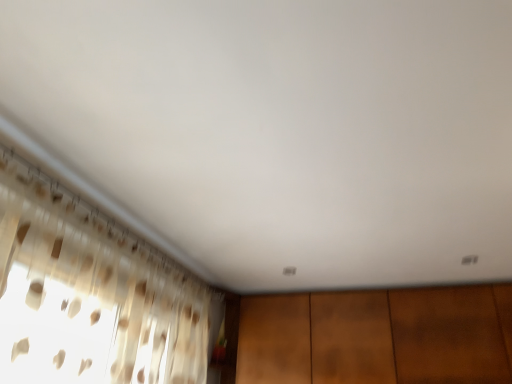
Question: Does brown wood dresser at lower center appear on the right side of translucent fabric curtain at left?

Choices:
 (A) no
 (B) yes

Answer: (B)

Question: Is brown wood dresser at lower center in front of translucent fabric curtain at left?

Choices:
 (A) no
 (B) yes

Answer: (A)

Question: Is brown wood dresser at lower center far away from translucent fabric curtain at left?

Choices:
 (A) yes
 (B) no

Answer: (A)

Question: From the image's perspective, does brown wood dresser at lower center appear lower than translucent fabric curtain at left?

Choices:
 (A) no
 (B) yes

Answer: (B)

Question: Is translucent fabric curtain at left at the back of brown wood dresser at lower center?

Choices:
 (A) yes
 (B) no

Answer: (B)

Question: Is brown wood dresser at lower center located outside translucent fabric curtain at left?

Choices:
 (A) no
 (B) yes

Answer: (B)

Question: Considering the relative sizes of translucent fabric curtain at left and brown wood dresser at lower center in the image provided, is translucent fabric curtain at left wider than brown wood dresser at lower center?

Choices:
 (A) no
 (B) yes

Answer: (A)

Question: Does translucent fabric curtain at left have a greater height compared to brown wood dresser at lower center?

Choices:
 (A) yes
 (B) no

Answer: (A)

Question: Considering the relative positions of translucent fabric curtain at left and brown wood dresser at lower center in the image provided, is translucent fabric curtain at left to the right of brown wood dresser at lower center from the viewer's perspective?

Choices:
 (A) no
 (B) yes

Answer: (A)

Question: Is translucent fabric curtain at left positioned in front of brown wood dresser at lower center?

Choices:
 (A) yes
 (B) no

Answer: (A)

Question: Can you see translucent fabric curtain at left touching brown wood dresser at lower center?

Choices:
 (A) no
 (B) yes

Answer: (A)

Question: Considering the relative sizes of translucent fabric curtain at left and brown wood dresser at lower center in the image provided, is translucent fabric curtain at left shorter than brown wood dresser at lower center?

Choices:
 (A) no
 (B) yes

Answer: (A)

Question: Visually, is translucent fabric curtain at left positioned to the left or to the right of brown wood dresser at lower center?

Choices:
 (A) left
 (B) right

Answer: (A)